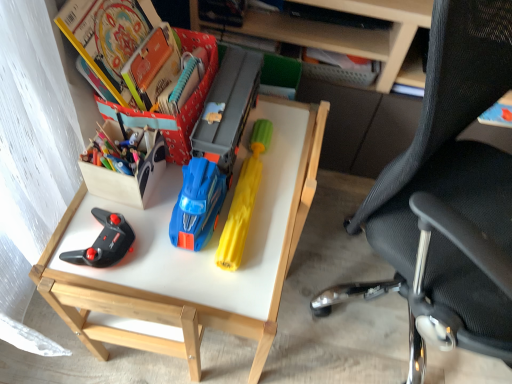
Question: Does matte plastic desk at center have a smaller size compared to yellow rubber toy at center?

Choices:
 (A) no
 (B) yes

Answer: (A)

Question: Is matte plastic desk at center further to the viewer compared to yellow rubber toy at center?

Choices:
 (A) no
 (B) yes

Answer: (A)

Question: From the image's perspective, is matte plastic desk at center located beneath yellow rubber toy at center?

Choices:
 (A) no
 (B) yes

Answer: (B)

Question: From a real-world perspective, is matte plastic desk at center positioned over yellow rubber toy at center based on gravity?

Choices:
 (A) no
 (B) yes

Answer: (A)

Question: Considering the relative sizes of matte plastic desk at center and yellow rubber toy at center in the image provided, is matte plastic desk at center thinner than yellow rubber toy at center?

Choices:
 (A) yes
 (B) no

Answer: (B)

Question: Is matte plastic desk at center placed right next to yellow rubber toy at center?

Choices:
 (A) no
 (B) yes

Answer: (A)

Question: Is hardcover book at upper left, positioned as the 3th book in back-to-front order, in front of matte paper book at upper left, placed as the first book when sorted from back to front?

Choices:
 (A) no
 (B) yes

Answer: (B)

Question: Can you confirm if hardcover book at upper left, which is counted as the first book, starting from the front, is taller than matte paper book at upper left, the 3th book in the front-to-back sequence?

Choices:
 (A) no
 (B) yes

Answer: (B)

Question: Can you confirm if hardcover book at upper left, which is counted as the first book, starting from the front, is bigger than matte paper book at upper left, placed as the first book when sorted from back to front?

Choices:
 (A) no
 (B) yes

Answer: (A)

Question: Does hardcover book at upper left, which is counted as the first book, starting from the front, have a greater width compared to matte paper book at upper left, the 3th book in the front-to-back sequence?

Choices:
 (A) yes
 (B) no

Answer: (B)

Question: Is hardcover book at upper left, positioned as the 3th book in back-to-front order, shorter than matte paper book at upper left, placed as the first book when sorted from back to front?

Choices:
 (A) no
 (B) yes

Answer: (A)

Question: From the image's perspective, does hardcover book at upper left, positioned as the 3th book in back-to-front order, appear higher than matte paper book at upper left, the 3th book in the front-to-back sequence?

Choices:
 (A) no
 (B) yes

Answer: (B)

Question: Considering the relative positions of yellow rubber toy at center and wooden box at left in the image provided, is yellow rubber toy at center to the left of wooden box at left from the viewer's perspective?

Choices:
 (A) yes
 (B) no

Answer: (B)